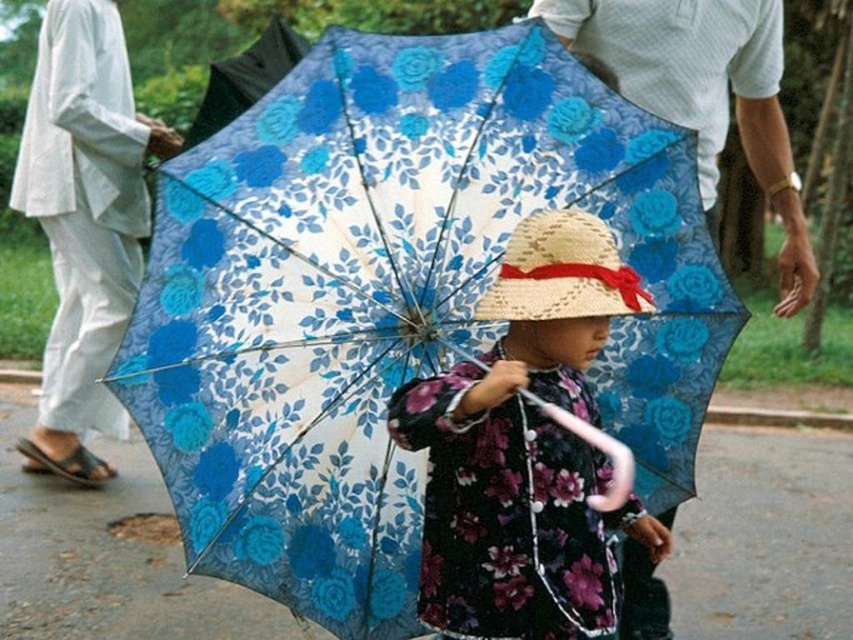
You are standing in the park and see two points in the image. The first point is at coordinate point (x=199, y=435) and the second is at point (x=682, y=28). Which point is closer to you?

Point (x=199, y=435) is closer to the viewer than point (x=682, y=28).